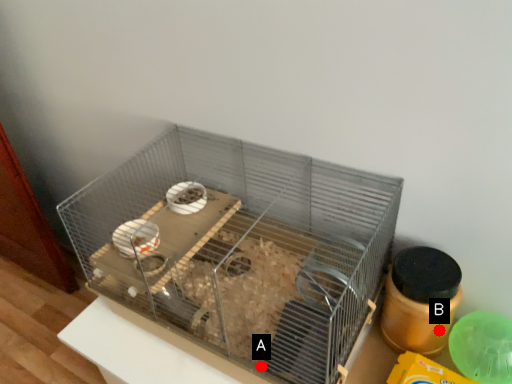
Question: Two points are circled on the image, labeled by A and B beside each circle. Which point is closer to the camera taking this photo?

Choices:
 (A) A is closer
 (B) B is closer

Answer: (A)